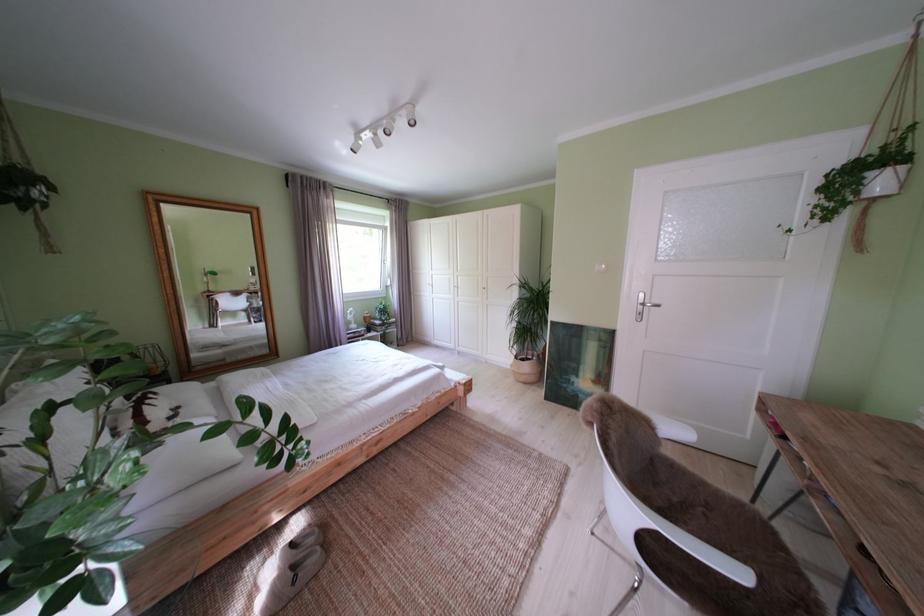
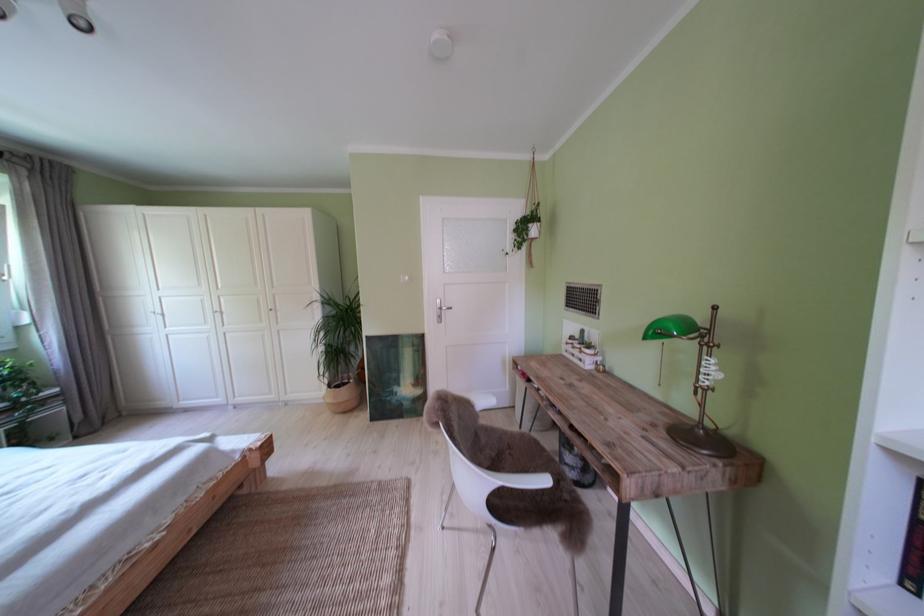
Question: The images are taken continuously from a first-person perspective. In which direction is your viewpoint rotating?

Choices:
 (A) Left
 (B) Right
 (C) Up
 (D) Down

Answer: (B)